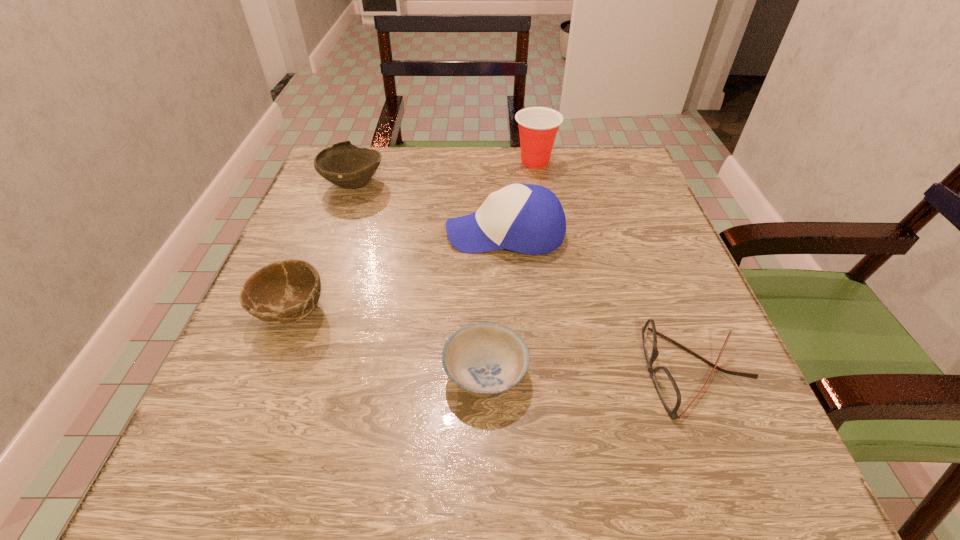
Locate an element on the screen. The height and width of the screenshot is (540, 960). object that is at the far left corner is located at coordinates (343, 164).

This screenshot has height=540, width=960. In the image, there is a desktop. In order to click on vacant region at the far edge in this screenshot , I will do `click(521, 167)`.

Where is `free space at the near edge`? free space at the near edge is located at coordinates (505, 465).

Locate an element on the screen. vacant region at the left edge of the desktop is located at coordinates [x=357, y=253].

The width and height of the screenshot is (960, 540). In the image, there is a desktop. Find the location of `vacant space at the right edge`. vacant space at the right edge is located at coordinates (654, 388).

Where is `free point at the far left corner`? The image size is (960, 540). free point at the far left corner is located at coordinates (382, 159).

Locate an element on the screen. vacant area at the near left corner of the desktop is located at coordinates (219, 442).

Locate an element on the screen. vacant region at the far right corner of the desktop is located at coordinates (613, 165).

Locate an element on the screen. The width and height of the screenshot is (960, 540). vacant space that is in between the rightmost object and the shortest bowl is located at coordinates (589, 373).

Identify the location of vacant space in between the second nearest bowl and the farthest bowl. This screenshot has height=540, width=960. (323, 247).